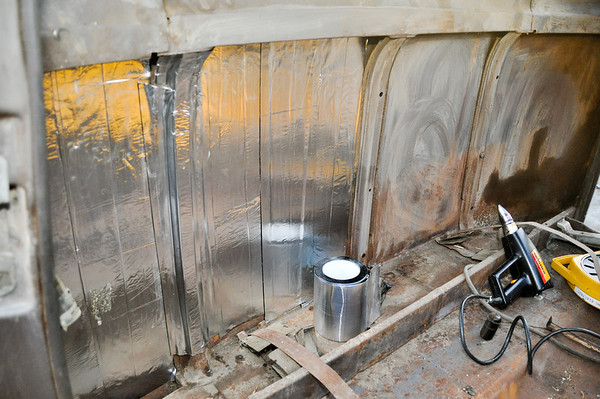
At what (x,y) coordinates should I click in order to perform the action: click on concrete floor. Please return your answer as a coordinate pair (x, y). This screenshot has width=600, height=399. Looking at the image, I should click on (437, 371).